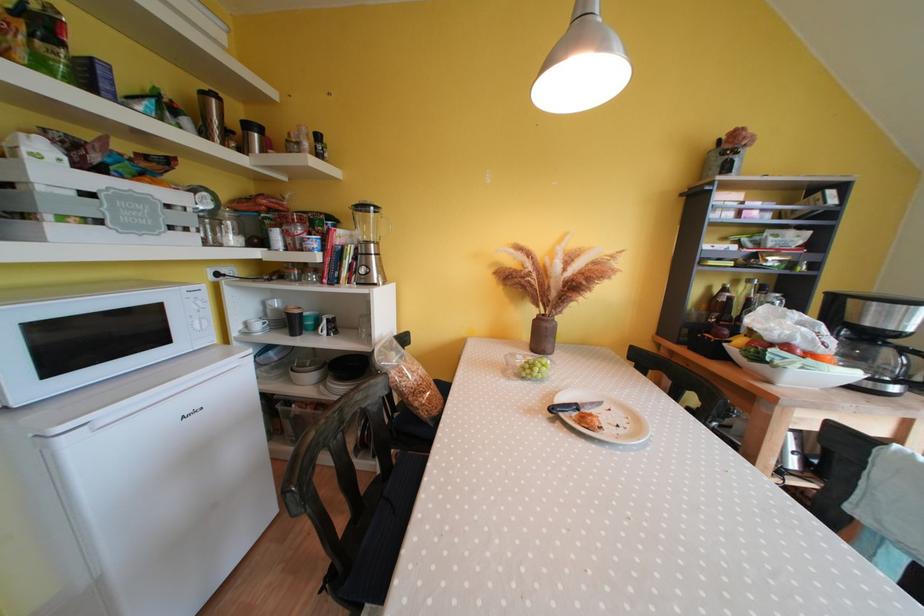
What do you see at coordinates (205, 339) in the screenshot? I see `the microwave open button` at bounding box center [205, 339].